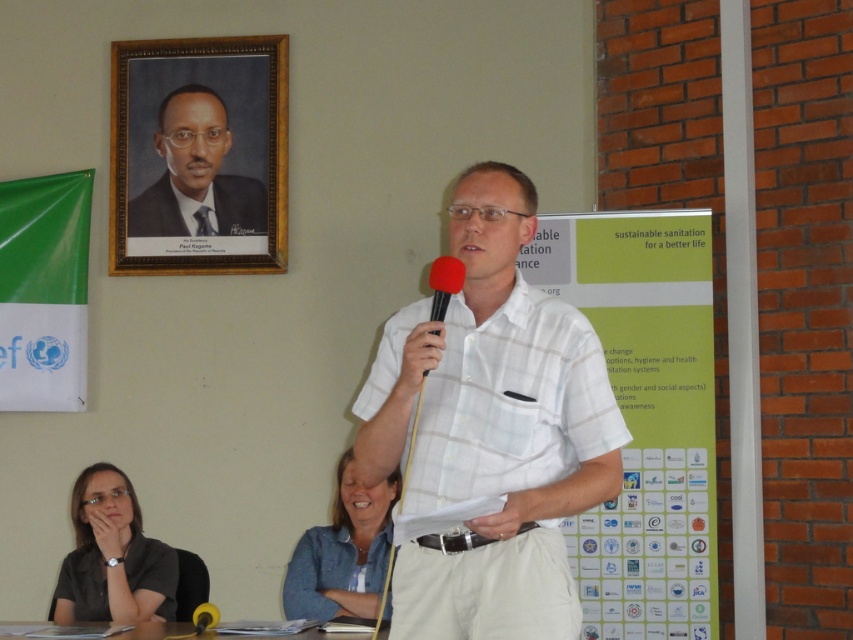
Which is more to the right, white checkered shirt at center or blue denim shirt at lower center?

Positioned to the right is white checkered shirt at center.

Does white checkered shirt at center have a lesser height compared to blue denim shirt at lower center?

No.

Is point (521, 196) more distant than point (358, 508)?

No.

Find the location of a particular element. The height and width of the screenshot is (640, 853). white checkered shirt at center is located at coordinates (491, 429).

Is wooden picture frame at upper left positioned in front of blue denim shirt at lower center?

No, wooden picture frame at upper left is behind blue denim shirt at lower center.

From the picture: Can you confirm if wooden picture frame at upper left is positioned below blue denim shirt at lower center?

No, wooden picture frame at upper left is not below blue denim shirt at lower center.

This screenshot has width=853, height=640. Identify the location of wooden picture frame at upper left. (198, 156).

The image size is (853, 640). Find the location of `wooden picture frame at upper left`. wooden picture frame at upper left is located at coordinates (198, 156).

Between wooden picture frame at upper left and matte red microphone at center, which one has less height?

Standing shorter between the two is matte red microphone at center.

Is point (180, 160) closer to camera compared to point (437, 291)?

No, it is not.

Between point (215, 246) and point (439, 308), which one is positioned behind?

Point (215, 246)

Locate an element on the screen. This screenshot has height=640, width=853. wooden picture frame at upper left is located at coordinates (198, 156).